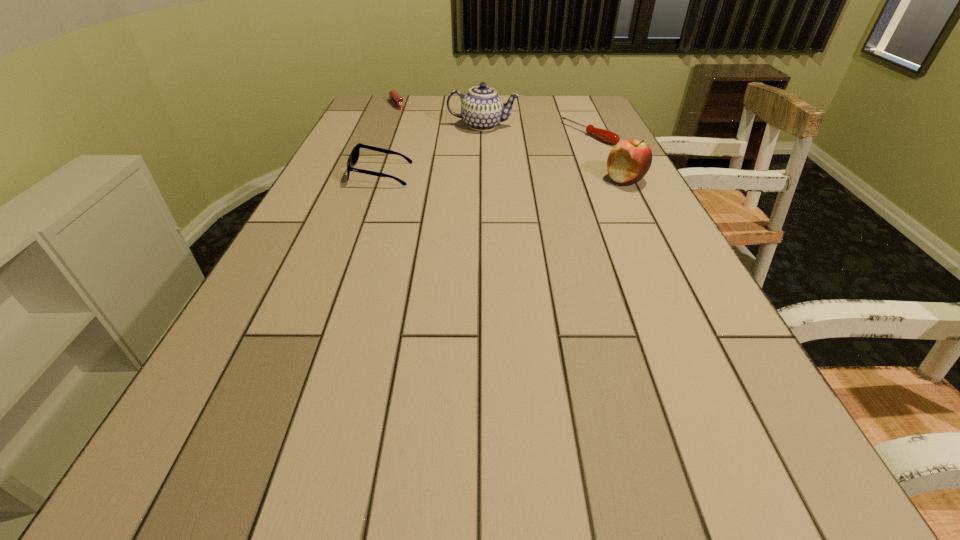
Locate an element on the screen. Image resolution: width=960 pixels, height=540 pixels. vacant region at the right edge of the desktop is located at coordinates (684, 286).

At what (x,y) coordinates should I click in order to perform the action: click on free spot at the far left corner of the desktop. Please return your answer as a coordinate pair (x, y). This screenshot has width=960, height=540. Looking at the image, I should click on (383, 107).

In the image, there is a desktop. Where is `vacant space at the near left corner`? The image size is (960, 540). vacant space at the near left corner is located at coordinates (277, 434).

Find the location of a particular element. The height and width of the screenshot is (540, 960). vacant position at the far right corner of the desktop is located at coordinates (562, 114).

At what (x,y) coordinates should I click in order to perform the action: click on free spot at the near right corner of the desktop. Please return your answer as a coordinate pair (x, y). The image size is (960, 540). Looking at the image, I should click on (697, 444).

Where is `empty location between the shortest object and the apple`? This screenshot has height=540, width=960. empty location between the shortest object and the apple is located at coordinates (607, 157).

Locate an element on the screen. Image resolution: width=960 pixels, height=540 pixels. vacant area that lies between the chinaware and the fourth shortest object is located at coordinates (554, 153).

You are a GUI agent. You are given a task and a screenshot of the screen. Output one action in this format:
    pyautogui.click(x=<x>, y=<y>)
    Task: Click on the blank region between the tallest object and the shortest object
    This screenshot has width=960, height=540.
    Given the screenshot: What is the action you would take?
    pyautogui.click(x=536, y=130)

Find the location of a particular element. The height and width of the screenshot is (540, 960). free space between the third shortest object and the apple is located at coordinates (503, 177).

Locate an element on the screen. vacant area that lies between the shortest object and the third object from left to right is located at coordinates (536, 130).